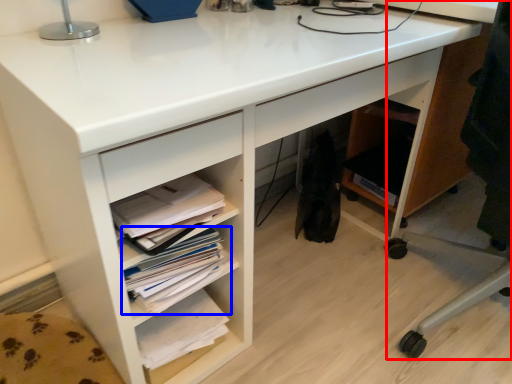
Question: Among these objects, which one is nearest to the camera, computer chair (highlighted by a red box) or book (highlighted by a blue box)?

Choices:
 (A) computer chair
 (B) book

Answer: (A)